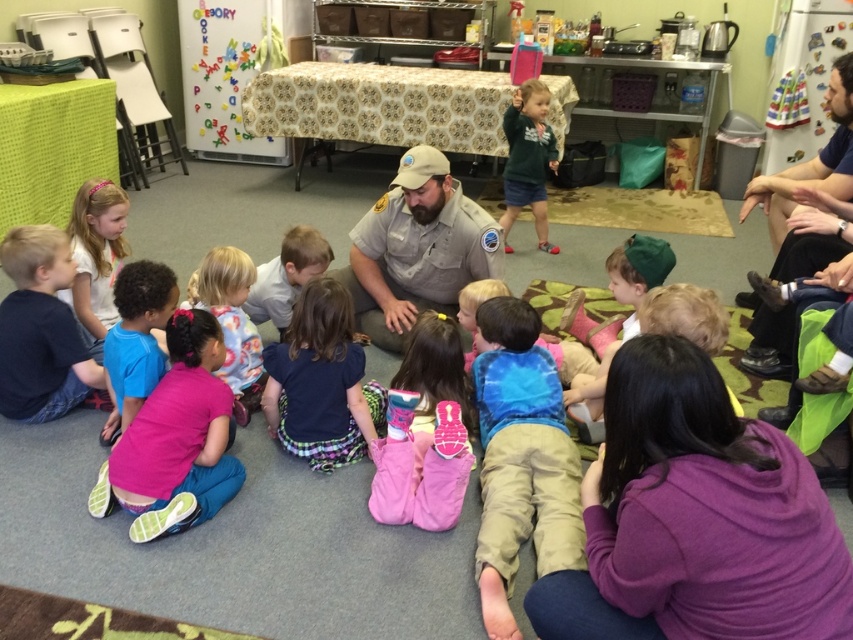
Question: Among these objects, which one is farthest from the camera?

Choices:
 (A) white matte shirt at center
 (B) purple soft sweater at lower right

Answer: (A)

Question: Does purple soft sweater at lower right have a larger size compared to pink fabric pants at lower left?

Choices:
 (A) no
 (B) yes

Answer: (B)

Question: Which is nearer to the dark blue fabric skirt at center?

Choices:
 (A) dark blue fabric pants at lower left
 (B) tie-dye shirt at center
 (C) pink fabric pants at lower left

Answer: (C)

Question: Is pink fabric pants at lower left positioned at the back of dark blue fabric skirt at center?

Choices:
 (A) no
 (B) yes

Answer: (A)

Question: Is dark blue fabric pants at lower left to the left of green fuzzy sweater at upper right from the viewer's perspective?

Choices:
 (A) no
 (B) yes

Answer: (B)

Question: Which object is farther from the camera taking this photo?

Choices:
 (A) green fuzzy sweater at upper right
 (B) white matte shirt at center
 (C) dark blue fabric pants at lower left

Answer: (A)